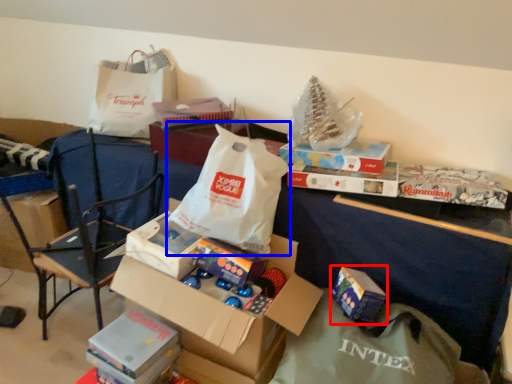
Question: Which object appears closest to the camera in this image, gift (highlighted by a red box) or grocery bag (highlighted by a blue box)?

Choices:
 (A) gift
 (B) grocery bag

Answer: (B)